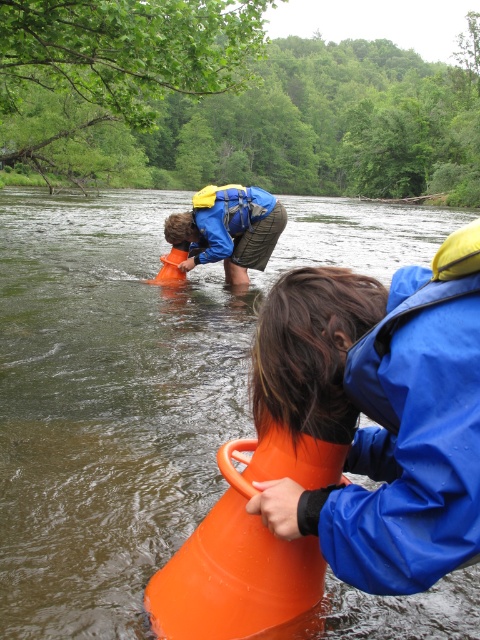
Based on the photo, which of these two, orange plastic cone at center or matte blue jacket at center, stands taller?

Standing taller between the two is orange plastic cone at center.

What do you see at coordinates (134, 387) in the screenshot? I see `orange plastic cone at center` at bounding box center [134, 387].

The image size is (480, 640). In order to click on orange plastic cone at center in this screenshot , I will do `click(134, 387)`.

The image size is (480, 640). Describe the element at coordinates (414, 432) in the screenshot. I see `blue waterproof jacket at lower right` at that location.

Is blue waterproof jacket at lower right above matte blue jacket at center?

Incorrect, blue waterproof jacket at lower right is not positioned above matte blue jacket at center.

Identify the location of blue waterproof jacket at lower right. click(x=414, y=432).

Is orange plastic cone at center further to the viewer compared to blue waterproof jacket at lower right?

Yes, it is.

Between orange plastic cone at center and blue waterproof jacket at lower right, which one is positioned lower?

blue waterproof jacket at lower right

Is point (301, 227) positioned before point (416, 506)?

No.

Where is `orange plastic cone at center`? orange plastic cone at center is located at coordinates (134, 387).